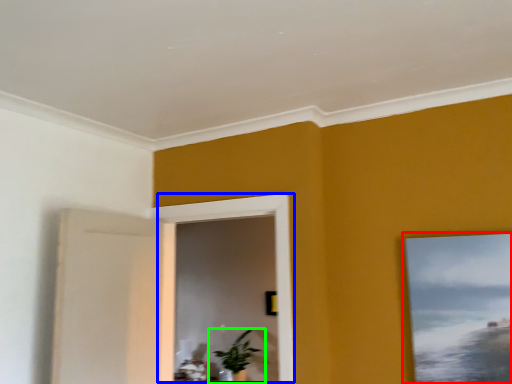
Question: Based on their relative distances, which object is farther from picture frame (highlighted by a red box)? Choose from window (highlighted by a blue box) and houseplant (highlighted by a green box).

Choices:
 (A) window
 (B) houseplant

Answer: (B)